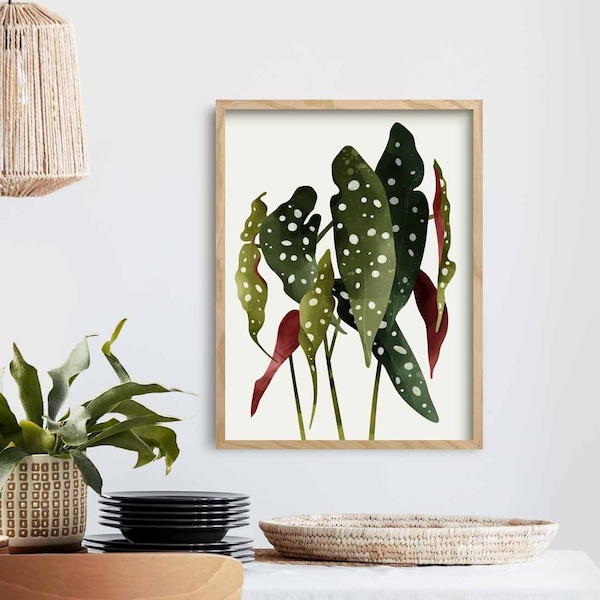
Locate an element on the screen. The height and width of the screenshot is (600, 600). pot is located at coordinates (16, 491).